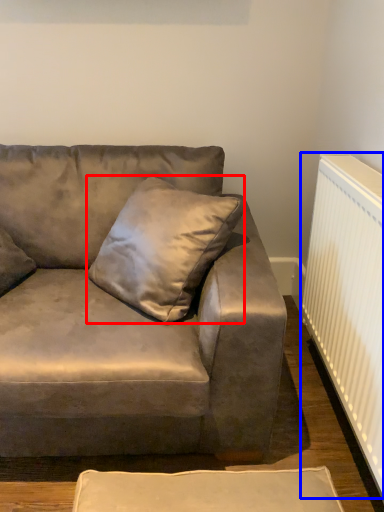
Question: Among these objects, which one is nearest to the camera, pillow (highlighted by a red box) or radiator (highlighted by a blue box)?

Choices:
 (A) pillow
 (B) radiator

Answer: (A)